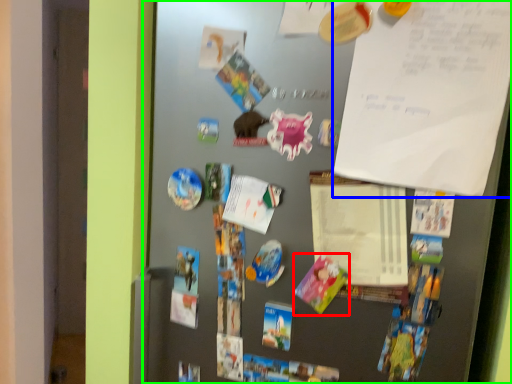
Question: Which object is positioned closest to postcard (highlighted by a red box)? Select from poster (highlighted by a blue box) and fridge (highlighted by a green box).

Choices:
 (A) poster
 (B) fridge

Answer: (B)